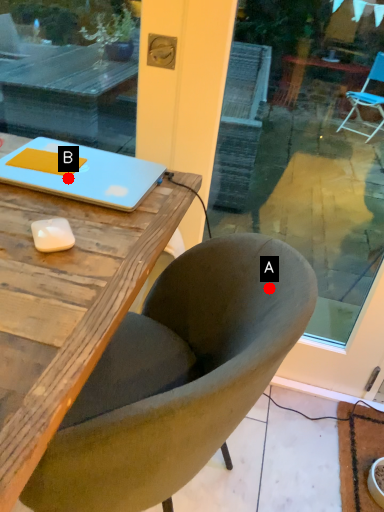
Question: Two points are circled on the image, labeled by A and B beside each circle. Among these points, which one is farthest from the camera?

Choices:
 (A) A is further
 (B) B is further

Answer: (B)